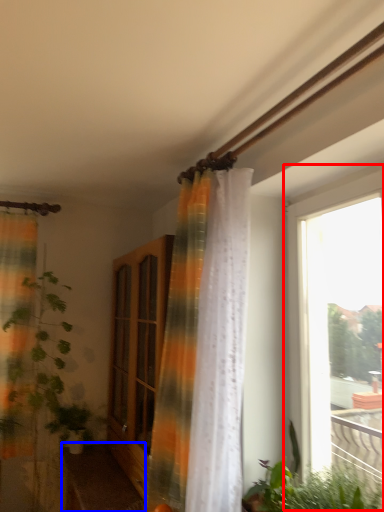
Question: Which object is further to the camera taking this photo, window (highlighted by a red box) or furniture (highlighted by a blue box)?

Choices:
 (A) window
 (B) furniture

Answer: (B)